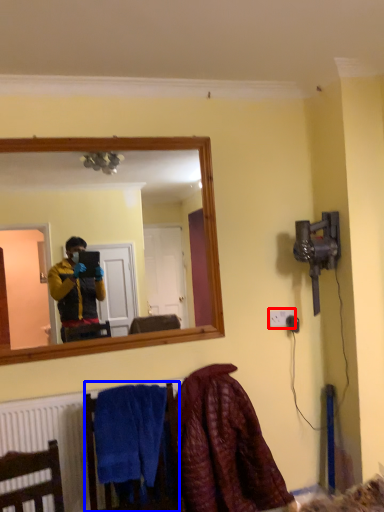
Question: Among these objects, which one is farthest to the camera, electric outlet (highlighted by a red box) or armchair (highlighted by a blue box)?

Choices:
 (A) electric outlet
 (B) armchair

Answer: (A)